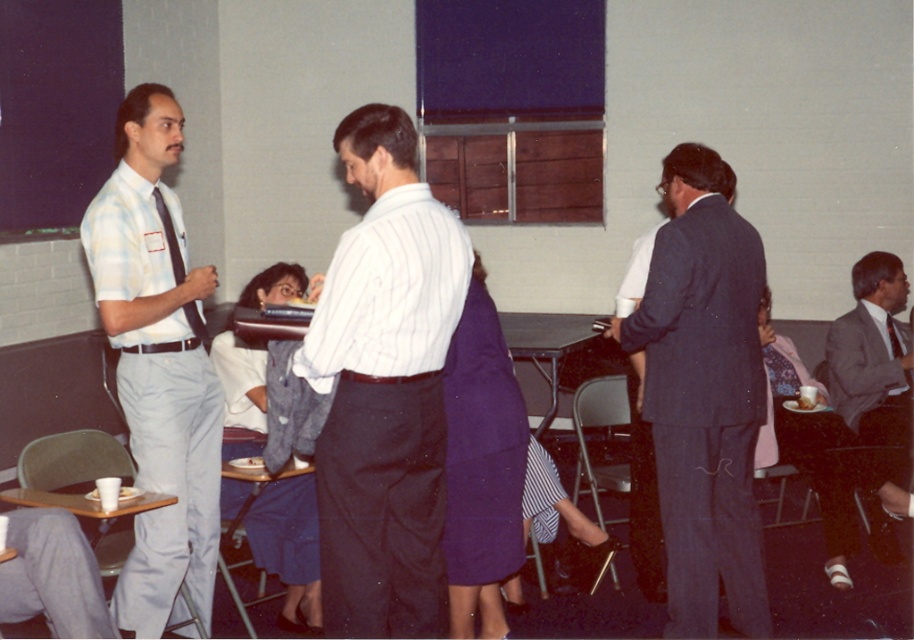
Question: Is gray suit jacket at lower right closer to camera compared to matte purple skirt at lower right?

Choices:
 (A) yes
 (B) no

Answer: (B)

Question: Which of these objects is positioned closest to the matte purple skirt at lower right?

Choices:
 (A) purple fabric skirt at center
 (B) gray suit jacket at lower right
 (C) white fabric dress at center
 (D) light blue plaid shirt at left

Answer: (B)

Question: Can you confirm if dark blue suit at center is wider than light blue plaid shirt at left?

Choices:
 (A) yes
 (B) no

Answer: (A)

Question: Is light blue plaid shirt at left behind purple fabric skirt at center?

Choices:
 (A) no
 (B) yes

Answer: (A)

Question: Which point is closer to the camera?

Choices:
 (A) (307, 518)
 (B) (617, 323)
 (C) (349, 545)

Answer: (C)

Question: Which object appears closest to the camera in this image?

Choices:
 (A) dark blue suit at center
 (B) light blue plaid shirt at left

Answer: (B)